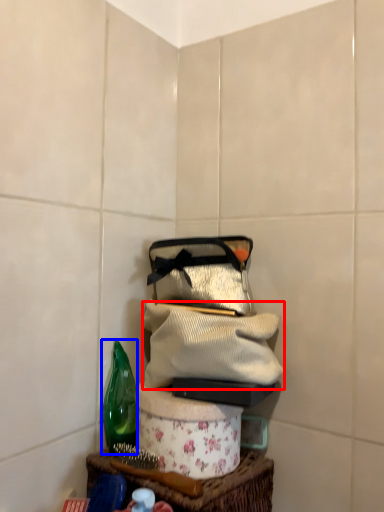
Question: Which of the following is the farthest to the observer, clothing (highlighted by a red box) or bottle (highlighted by a blue box)?

Choices:
 (A) clothing
 (B) bottle

Answer: (B)